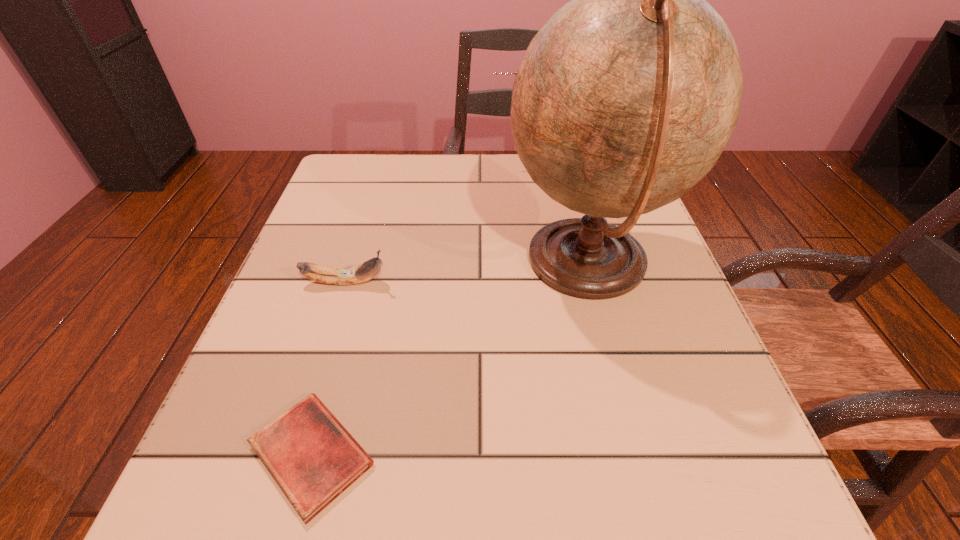
I want to click on free point between the shortest object and the drill, so click(430, 309).

This screenshot has height=540, width=960. I want to click on empty location between the banana and the drill, so click(x=447, y=223).

Identify the location of free space that is in between the tallest object and the second shortest object. (467, 273).

Locate an element on the screen. This screenshot has height=540, width=960. free space between the nearest object and the second tallest object is located at coordinates (430, 309).

The width and height of the screenshot is (960, 540). In order to click on vacant point located between the shortest object and the banana in this screenshot , I will do `click(328, 368)`.

Locate an element on the screen. empty space that is in between the globe and the second tallest object is located at coordinates (568, 214).

At what (x,y) coordinates should I click in order to perform the action: click on free spot between the tallest object and the third tallest object. Please return your answer as a coordinate pair (x, y). Looking at the image, I should click on (467, 273).

Where is `object that is the closest to the banana`? object that is the closest to the banana is located at coordinates (625, 99).

Select which object is the second closest to the third tallest object. Please provide its 2D coordinates. Your answer should be formatted as a tuple, i.e. [(x, y)], where the tuple contains the x and y coordinates of a point satisfying the conditions above.

[(311, 456)]

This screenshot has width=960, height=540. Find the location of `vacant space that satisfies the following two spatial constraints: 1. at the stem of the banana; 2. on the right side of the diary`. vacant space that satisfies the following two spatial constraints: 1. at the stem of the banana; 2. on the right side of the diary is located at coordinates (292, 454).